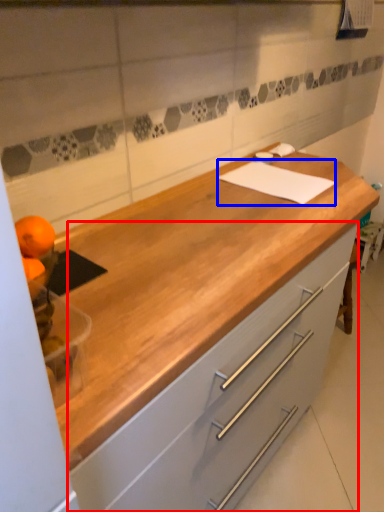
Question: Among these objects, which one is nearest to the camera, cabinetry (highlighted by a red box) or notepad (highlighted by a blue box)?

Choices:
 (A) cabinetry
 (B) notepad

Answer: (A)